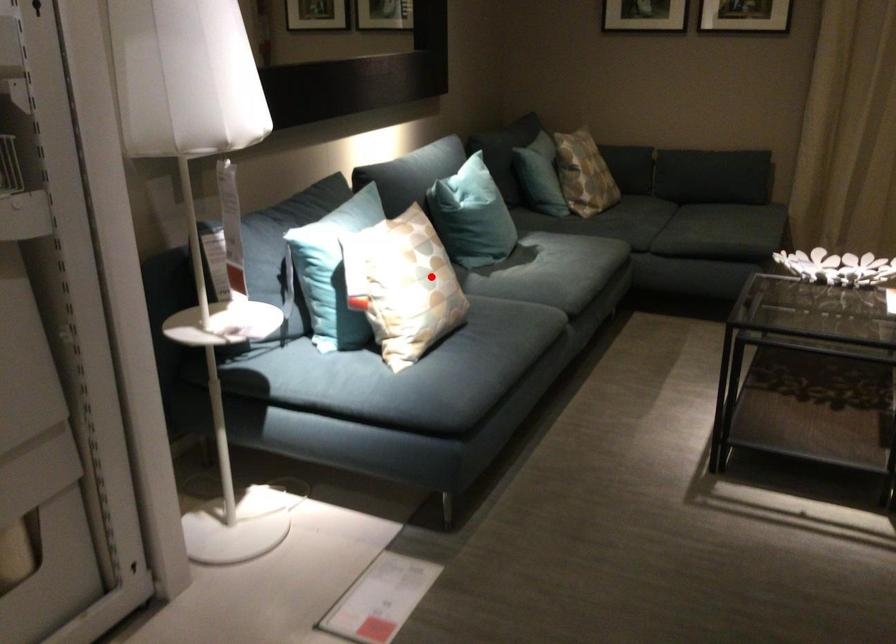
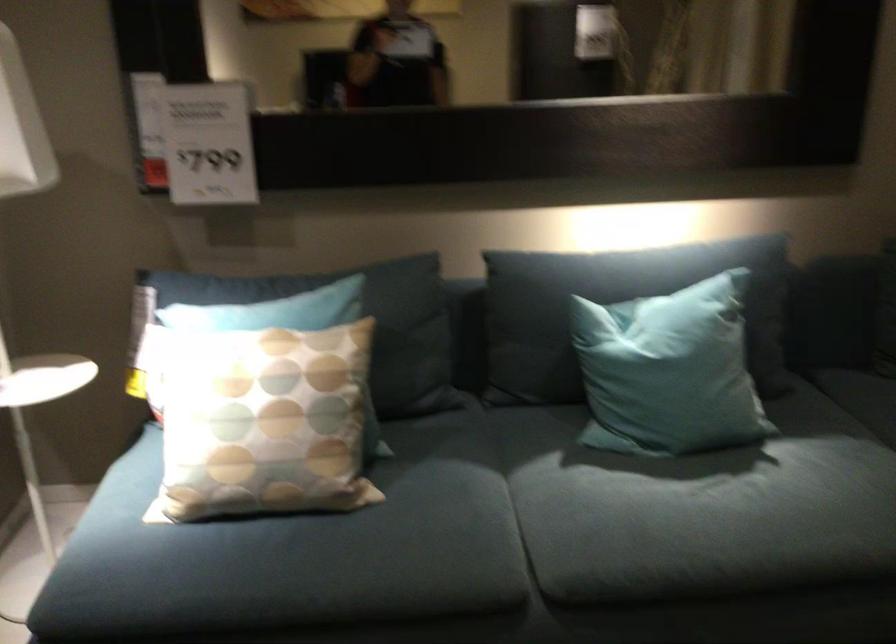
Question: A red point is marked in image1. In image2, is the corresponding 3D point closer to the camera or farther? Reply with the corresponding letter.

Choices:
 (A) The corresponding 3D point is closer.
 (B) The corresponding 3D point is farther.

Answer: (A)